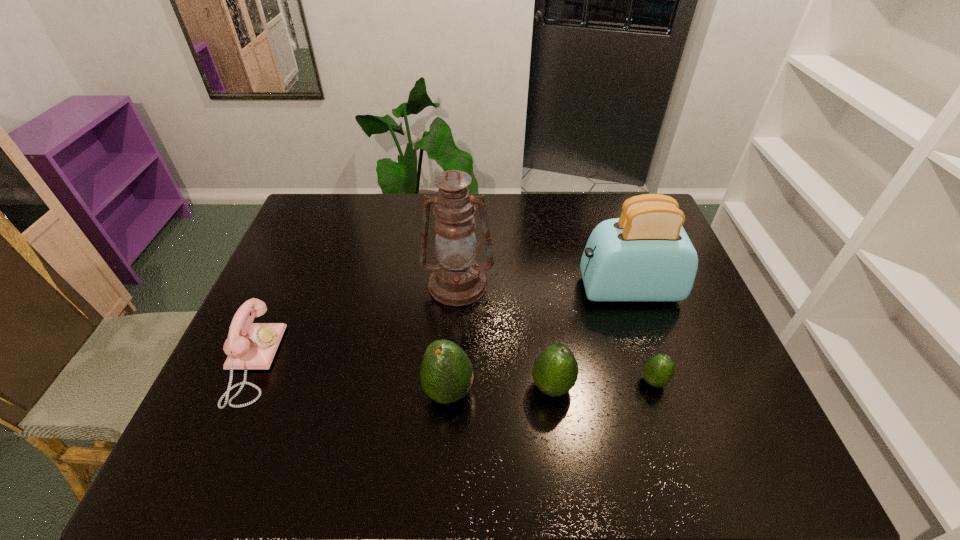
Identify the location of the leftmost avocado. The width and height of the screenshot is (960, 540). (446, 373).

Where is `the second tallest avocado`? The height and width of the screenshot is (540, 960). the second tallest avocado is located at coordinates (555, 370).

Identify the location of the third object from right to left. (555, 370).

The height and width of the screenshot is (540, 960). In order to click on the shortest avocado in this screenshot , I will do `click(658, 370)`.

Find the location of a particular element. the shortest object is located at coordinates (658, 370).

At what (x,y) coordinates should I click in order to perform the action: click on the fifth shortest object. Please return your answer as a coordinate pair (x, y). The height and width of the screenshot is (540, 960). Looking at the image, I should click on (645, 255).

Identify the location of oil lamp. Image resolution: width=960 pixels, height=540 pixels. (456, 280).

The width and height of the screenshot is (960, 540). Identify the location of the leftmost object. (249, 345).

This screenshot has height=540, width=960. Find the location of `vacant space located 0.320m on the left of the leftmost avocado`. vacant space located 0.320m on the left of the leftmost avocado is located at coordinates (289, 393).

Where is `free space located 0.110m on the left of the second avocado from left to right`? free space located 0.110m on the left of the second avocado from left to right is located at coordinates (484, 387).